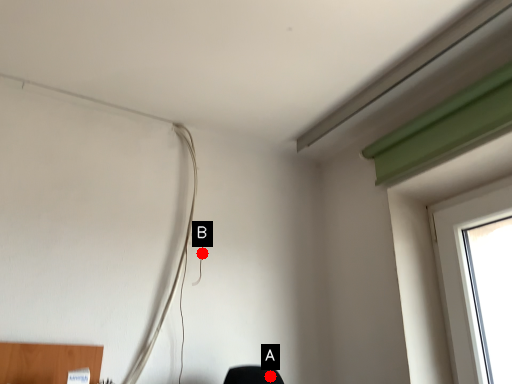
Question: Two points are circled on the image, labeled by A and B beside each circle. Which point is farther from the camera taking this photo?

Choices:
 (A) A is further
 (B) B is further

Answer: (B)